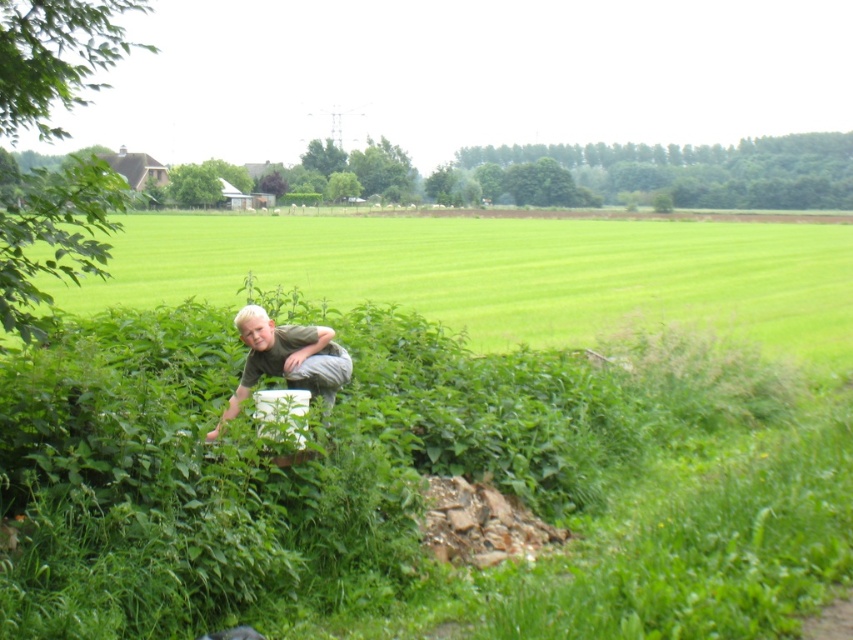
Question: Which point is closer to the camera?

Choices:
 (A) (404, 401)
 (B) (224, 410)

Answer: (B)

Question: Can you confirm if green grass at lower center is smaller than light brown fabric shirt at center?

Choices:
 (A) no
 (B) yes

Answer: (A)

Question: Is green grass at lower center behind light brown fabric shirt at center?

Choices:
 (A) no
 (B) yes

Answer: (B)

Question: Which object is farther from the camera taking this photo?

Choices:
 (A) light brown fabric shirt at center
 (B) green leafy grass at center
 (C) green grass at lower center

Answer: (C)

Question: Which of the following is the closest to the observer?

Choices:
 (A) (230, 417)
 (B) (734, 337)
 (C) (647, 289)

Answer: (A)

Question: Is green grass at lower center positioned before light brown fabric shirt at center?

Choices:
 (A) yes
 (B) no

Answer: (B)